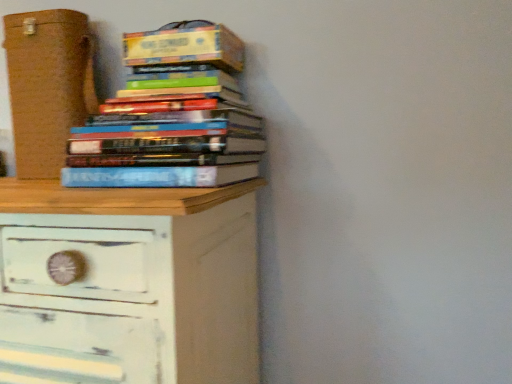
Where is `white distressed wood chest of drawers at lower left`? The width and height of the screenshot is (512, 384). white distressed wood chest of drawers at lower left is located at coordinates (145, 268).

What do you see at coordinates (47, 86) in the screenshot? I see `brown cardboard box at left` at bounding box center [47, 86].

Find the location of a particular element. hardcover books at upper center is located at coordinates (170, 117).

Find the location of `white distressed wood chest of drawers at lower left`. white distressed wood chest of drawers at lower left is located at coordinates (145, 268).

Between white distressed wood chest of drawers at lower left and hardcover book at upper left, which one has larger width?

With larger width is white distressed wood chest of drawers at lower left.

Is white distressed wood chest of drawers at lower left oriented towards hardcover book at upper left?

No.

Between point (252, 316) and point (221, 62), which one is positioned behind?

The point (252, 316) is behind.

Would you say white distressed wood chest of drawers at lower left is inside or outside hardcover book at upper left?

Answer: white distressed wood chest of drawers at lower left lies outside hardcover book at upper left.

What's the angular difference between brown cardboard box at left and hardcover book at upper left's facing directions?

They differ by 3.35 degrees in their facing directions.

Which is in front, brown cardboard box at left or hardcover book at upper left?

hardcover book at upper left is in front.

Considering the sizes of objects brown cardboard box at left and hardcover book at upper left in the image provided, who is thinner, brown cardboard box at left or hardcover book at upper left?

brown cardboard box at left is thinner.

Is brown cardboard box at left with hardcover book at upper left?

There is a gap between brown cardboard box at left and hardcover book at upper left.

Is hardcover book at upper left looking in the opposite direction of white distressed wood chest of drawers at lower left?

No, hardcover book at upper left is not facing away from white distressed wood chest of drawers at lower left.

Looking at this image, which is less distant, [184,58] or [168,267]?

Clearly, point [184,58] is more distant from the camera than point [168,267].

Is hardcover book at upper left completely or partially outside of white distressed wood chest of drawers at lower left?

Absolutely, hardcover book at upper left is external to white distressed wood chest of drawers at lower left.

Is hardcover book at upper left next to white distressed wood chest of drawers at lower left and touching it?

No, hardcover book at upper left is not touching white distressed wood chest of drawers at lower left.

Is white distressed wood chest of drawers at lower left in front of or behind hardcover books at upper center in the image?

white distressed wood chest of drawers at lower left is in front of hardcover books at upper center.

Are white distressed wood chest of drawers at lower left and hardcover books at upper center far apart?

white distressed wood chest of drawers at lower left is actually quite close to hardcover books at upper center.

Can you confirm if white distressed wood chest of drawers at lower left is thinner than hardcover books at upper center?

Incorrect, the width of white distressed wood chest of drawers at lower left is not less than that of hardcover books at upper center.

Is hardcover books at upper center a part of white distressed wood chest of drawers at lower left?

No.

Is brown cardboard box at left with hardcover books at upper center?

brown cardboard box at left and hardcover books at upper center are clearly separated.

Considering their positions, is brown cardboard box at left located in front of or behind hardcover books at upper center?

Clearly, brown cardboard box at left is behind hardcover books at upper center.

Is brown cardboard box at left aimed at hardcover books at upper center?

No.

Does point (41, 158) appear closer or farther from the camera than point (126, 110)?

Point (41, 158).

Who is bigger, hardcover book at upper left or brown cardboard box at left?

With larger size is brown cardboard box at left.

Consider the image. How distant is hardcover book at upper left from brown cardboard box at left?

The distance of hardcover book at upper left from brown cardboard box at left is 11.37 inches.

Image resolution: width=512 pixels, height=384 pixels. Identify the location of cardboard box behind the hardcover book at upper left. (47, 86).

Is hardcover book at upper left shorter than brown cardboard box at left?

Yes.

Does hardcover books at upper center turn towards brown cardboard box at left?

No, hardcover books at upper center does not turn towards brown cardboard box at left.

Based on their positions, is hardcover books at upper center located to the left or right of brown cardboard box at left?

Based on their positions, hardcover books at upper center is located to the right of brown cardboard box at left.

From a real-world perspective, which is physically below, hardcover books at upper center or brown cardboard box at left?

hardcover books at upper center is physically lower.

Which is behind, hardcover books at upper center or brown cardboard box at left?

brown cardboard box at left is behind.

At what (x,y) coordinates should I click in order to perform the action: click on the chest of drawers located underneath the hardcover book at upper left (from a real-world perspective). Please return your answer as a coordinate pair (x, y). The width and height of the screenshot is (512, 384). Looking at the image, I should click on (145, 268).

Identify the location of paperback book above the brown cardboard box at left (from a real-world perspective). (185, 47).

When comparing their distances from hardcover book at upper left, does hardcover books at upper center or brown cardboard box at left seem closer?

The object closer to hardcover book at upper left is hardcover books at upper center.

From the picture: Which object lies further to the anchor point white distressed wood chest of drawers at lower left, hardcover books at upper center or brown cardboard box at left?

Based on the image, brown cardboard box at left appears to be further to white distressed wood chest of drawers at lower left.

Which object lies further to the anchor point brown cardboard box at left, hardcover book at upper left or white distressed wood chest of drawers at lower left?

white distressed wood chest of drawers at lower left is positioned further to the anchor brown cardboard box at left.

From the image, which object appears to be nearer to hardcover books at upper center, brown cardboard box at left or white distressed wood chest of drawers at lower left?

white distressed wood chest of drawers at lower left lies closer to hardcover books at upper center than the other object.

Looking at the image, which one is located closer to brown cardboard box at left, hardcover books at upper center or white distressed wood chest of drawers at lower left?

Among the two, hardcover books at upper center is located nearer to brown cardboard box at left.

From the image, which object appears to be nearer to hardcover book at upper left, brown cardboard box at left or hardcover books at upper center?

hardcover books at upper center is positioned closer to the anchor hardcover book at upper left.

Looking at the image, which one is located further to hardcover book at upper left, hardcover books at upper center or white distressed wood chest of drawers at lower left?

Based on the image, white distressed wood chest of drawers at lower left appears to be further to hardcover book at upper left.

Which object lies nearer to the anchor point hardcover book at upper left, brown cardboard box at left or white distressed wood chest of drawers at lower left?

The object closer to hardcover book at upper left is brown cardboard box at left.

Where is `book between hardcover book at upper left and white distressed wood chest of drawers at lower left vertically`? The height and width of the screenshot is (384, 512). book between hardcover book at upper left and white distressed wood chest of drawers at lower left vertically is located at coordinates (170, 117).

Locate an element on the screen. cardboard box between hardcover book at upper left and white distressed wood chest of drawers at lower left from top to bottom is located at coordinates (47, 86).

You are a GUI agent. You are given a task and a screenshot of the screen. Output one action in this format:
    pyautogui.click(x=<x>, y=<y>)
    Task: Click on the book between brown cardboard box at left and hardcover book at upper left in the horizontal direction
    The height and width of the screenshot is (384, 512).
    Given the screenshot: What is the action you would take?
    pyautogui.click(x=170, y=117)

Locate an element on the screen. book between brown cardboard box at left and white distressed wood chest of drawers at lower left in the up-down direction is located at coordinates (170, 117).